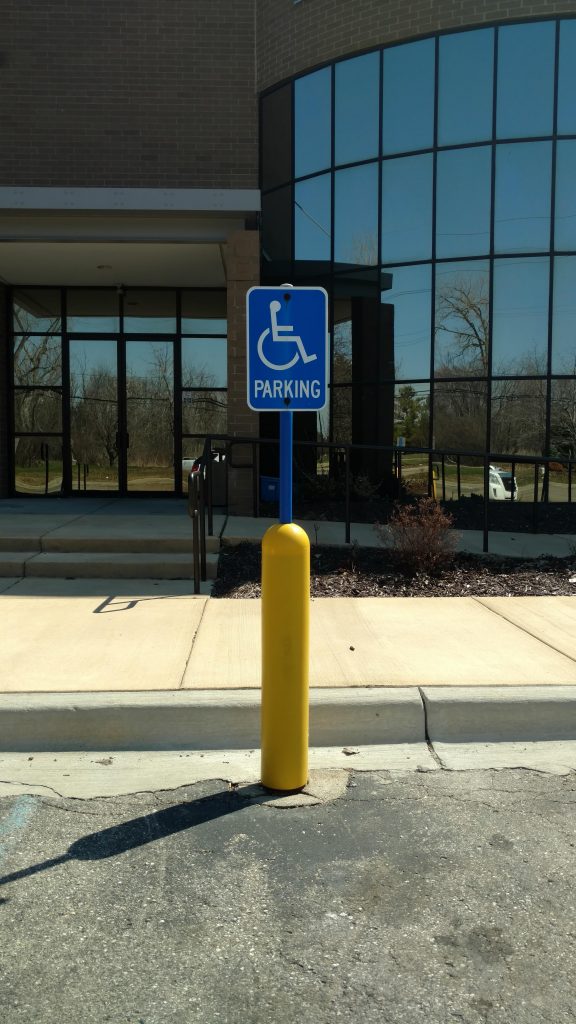
Where is `small plant on right`? small plant on right is located at coordinates (420, 551).